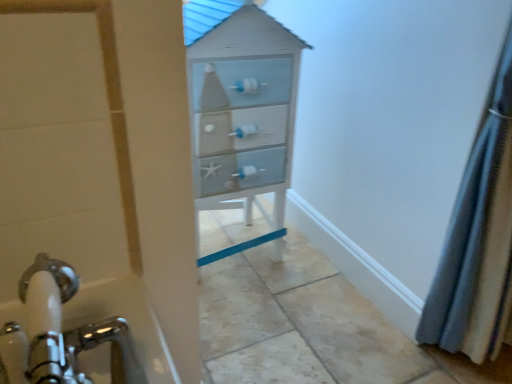
The width and height of the screenshot is (512, 384). Find the location of `vacant area that is in front of light blue painted wood chest of drawers at center`. vacant area that is in front of light blue painted wood chest of drawers at center is located at coordinates [x=259, y=319].